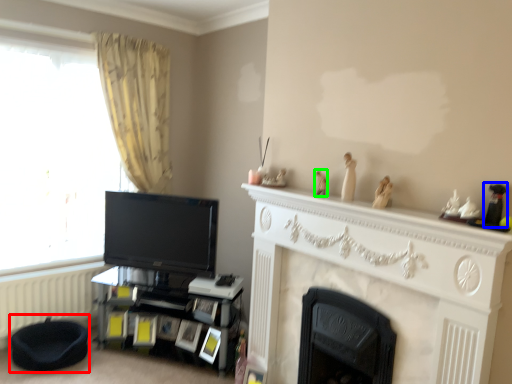
Question: Estimate the real-world distances between objects in this image. Which object is closer to bean bag chair (highlighted by a red box), toy (highlighted by a blue box) or toy (highlighted by a green box)?

Choices:
 (A) toy
 (B) toy

Answer: (B)